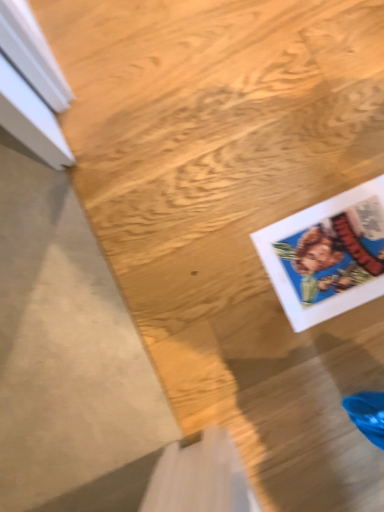
I want to click on blank space situated above matte paper comic book at lower right (from a real-world perspective), so click(336, 254).